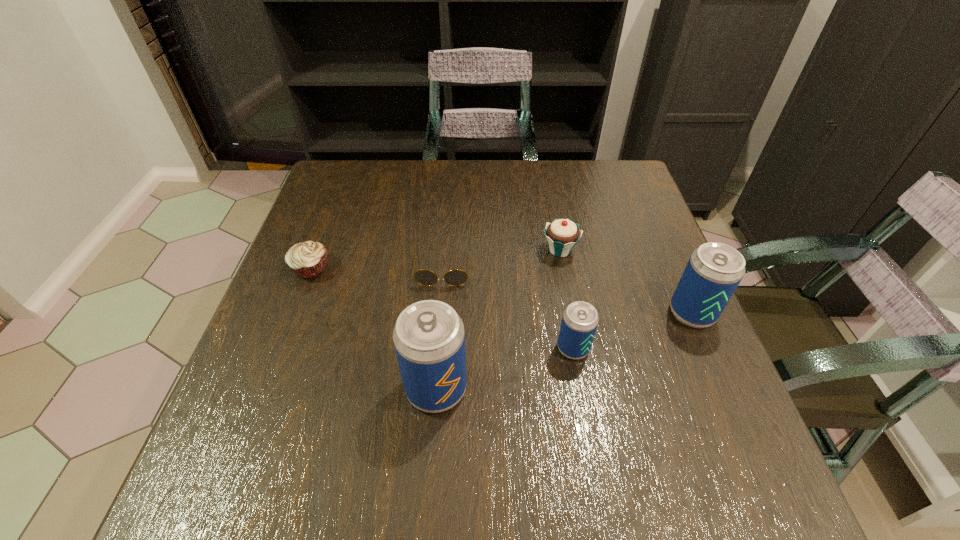
You are a GUI agent. You are given a task and a screenshot of the screen. Output one action in this format:
    pyautogui.click(x=<x>, y=<y>)
    Task: Click on the vacant area between the second nearest object and the sunglasses
    The image size is (960, 540).
    Given the screenshot: What is the action you would take?
    pyautogui.click(x=508, y=309)

This screenshot has height=540, width=960. I want to click on free point between the second shortest object and the rightmost object, so click(x=501, y=291).

You are a GUI agent. You are given a task and a screenshot of the screen. Output one action in this format:
    pyautogui.click(x=<x>, y=<y>)
    Task: Click on the empty space between the cupcake and the second shortest object
    
    Given the screenshot: What is the action you would take?
    pyautogui.click(x=436, y=259)

The width and height of the screenshot is (960, 540). Find the location of `object that can be found as the fifth closest to the leftmost object`. object that can be found as the fifth closest to the leftmost object is located at coordinates (714, 270).

Locate which object is the second closest to the third shortest object. Please provide its 2D coordinates. Your answer should be formatted as a tuple, i.e. [(x, y)], where the tuple contains the x and y coordinates of a point satisfying the conditions above.

[(714, 270)]

The width and height of the screenshot is (960, 540). Identify the location of beer can that is the third closest to the muffin. (714, 270).

Select which beer can appears as the second closest to the second beer can from left to right. Please provide its 2D coordinates. Your answer should be formatted as a tuple, i.e. [(x, y)], where the tuple contains the x and y coordinates of a point satisfying the conditions above.

[(714, 270)]

Where is `free spot that satisfies the following two spatial constraints: 1. on the lenses of the shortest object; 2. on the right side of the rightmost beer can`? free spot that satisfies the following two spatial constraints: 1. on the lenses of the shortest object; 2. on the right side of the rightmost beer can is located at coordinates (440, 313).